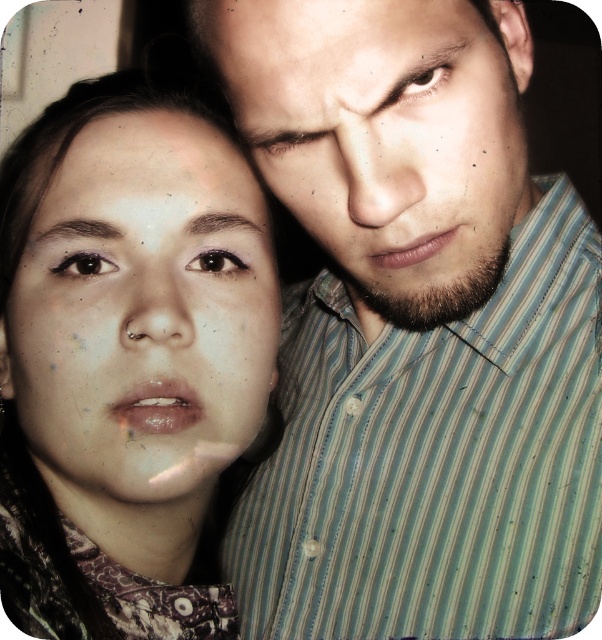
You are a photographer trying to adjust the lighting to highlight both the striped shirt at upper right and the matte skin face at left. Since the lighting is currently dim, which object should you focus on first to ensure proper exposure, considering their positions?

The striped shirt at upper right is located below matte skin face at left, so you should focus on the matte skin face at left first to ensure proper exposure since it is higher in the frame and closer to the light source.

You are standing in front of the two people in the image. You want to place a small sticker on the point that is closer to you. Which point should you choose between point (x=312, y=144) and point (x=455, y=148)?

Point (x=455, y=148) is closer to you because it is in front of point 0.225, 0.250 according to the description.